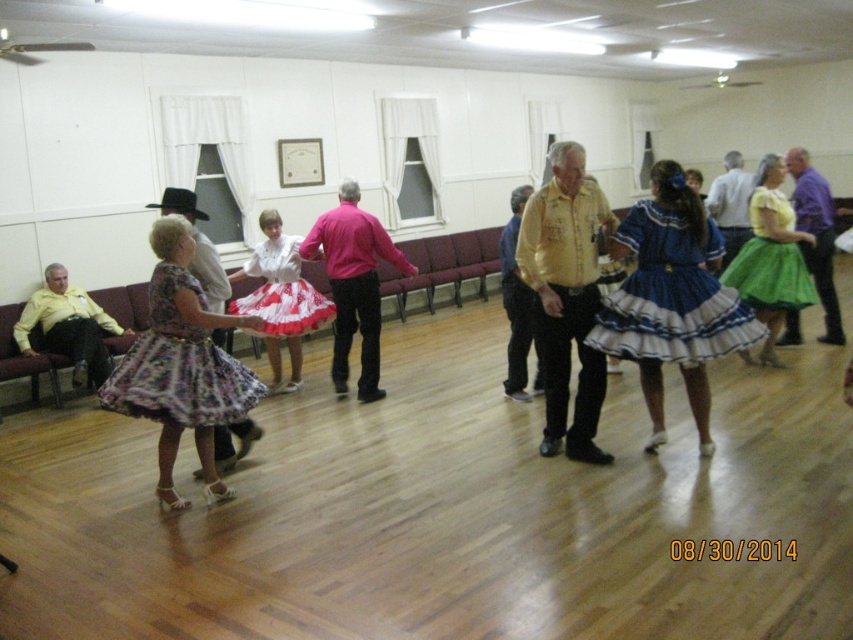
Which of these two, yellow textured shirt at center or green satin skirt at center, stands shorter?

green satin skirt at center is shorter.

Can you confirm if yellow textured shirt at center is positioned below green satin skirt at center?

Yes.

Where is `yellow textured shirt at center`? Image resolution: width=853 pixels, height=640 pixels. yellow textured shirt at center is located at coordinates (566, 296).

Locate an element on the screen. Image resolution: width=853 pixels, height=640 pixels. yellow textured shirt at center is located at coordinates (566, 296).

Can you confirm if floral-patterned fabric skirt at center is shorter than matte yellow shirt at left?

Indeed, floral-patterned fabric skirt at center has a lesser height compared to matte yellow shirt at left.

Based on the photo, who is taller, floral-patterned fabric skirt at center or matte yellow shirt at left?

Standing taller between the two is matte yellow shirt at left.

This screenshot has height=640, width=853. What are the coordinates of `floral-patterned fabric skirt at center` in the screenshot? It's located at (178, 365).

Who is positioned more to the right, matte black cowboy hat at left or matte yellow shirt at center?

From the viewer's perspective, matte yellow shirt at center appears more on the right side.

Is point (194, 272) positioned before point (743, 225)?

Yes, point (194, 272) is in front of point (743, 225).

Is point (225, 432) closer to camera compared to point (746, 228)?

That is True.

Where is `matte black cowboy hat at left`? matte black cowboy hat at left is located at coordinates (198, 244).